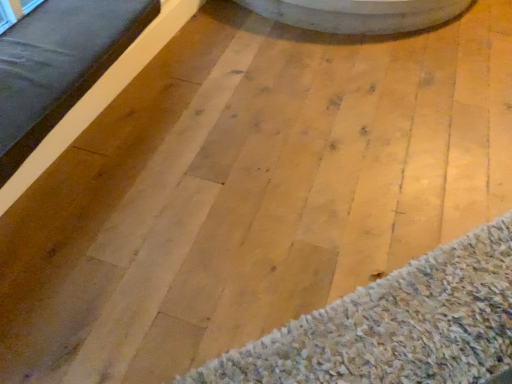
The height and width of the screenshot is (384, 512). What do you see at coordinates (58, 65) in the screenshot?
I see `matte wood bed frame at left` at bounding box center [58, 65].

Where is `matte wood bed frame at left`? The width and height of the screenshot is (512, 384). matte wood bed frame at left is located at coordinates (58, 65).

I want to click on woolen carpet at lower right, so click(396, 326).

The width and height of the screenshot is (512, 384). Describe the element at coordinates (396, 326) in the screenshot. I see `woolen carpet at lower right` at that location.

Locate an element on the screen. This screenshot has width=512, height=384. matte wood bed frame at left is located at coordinates coord(58,65).

Considering the positions of objects matte wood bed frame at left and woolen carpet at lower right in the image provided, who is more to the left, matte wood bed frame at left or woolen carpet at lower right?

Positioned to the left is matte wood bed frame at left.

In the image, is matte wood bed frame at left positioned in front of or behind woolen carpet at lower right?

matte wood bed frame at left is positioned farther from the viewer than woolen carpet at lower right.

Does point (13, 130) appear closer or farther from the camera than point (454, 304)?

Point (13, 130) is farther from the camera than point (454, 304).

From the image's perspective, between matte wood bed frame at left and woolen carpet at lower right, which one is located above?

matte wood bed frame at left, from the image's perspective.

From a real-world perspective, is matte wood bed frame at left above or below woolen carpet at lower right?

matte wood bed frame at left is above woolen carpet at lower right.

Looking at their sizes, would you say matte wood bed frame at left is wider or thinner than woolen carpet at lower right?

Considering their sizes, matte wood bed frame at left looks broader than woolen carpet at lower right.

Is matte wood bed frame at left shorter than woolen carpet at lower right?

In fact, matte wood bed frame at left may be taller than woolen carpet at lower right.

Is matte wood bed frame at left bigger or smaller than woolen carpet at lower right?

matte wood bed frame at left is bigger than woolen carpet at lower right.

Is matte wood bed frame at left outside of woolen carpet at lower right?

Absolutely, matte wood bed frame at left is external to woolen carpet at lower right.

Is matte wood bed frame at left positioned far away from woolen carpet at lower right?

That's right, there is a large distance between matte wood bed frame at left and woolen carpet at lower right.

Could you tell me if matte wood bed frame at left is turned towards woolen carpet at lower right?

No, matte wood bed frame at left is not turned towards woolen carpet at lower right.

From the picture: How different are the orientations of matte wood bed frame at left and woolen carpet at lower right in degrees?

They differ by 136 degrees in their facing directions.

How far apart are matte wood bed frame at left and woolen carpet at lower right?

They are 1.17 meters apart.

The height and width of the screenshot is (384, 512). Identify the location of furniture behind the woolen carpet at lower right. (58, 65).

Can you confirm if woolen carpet at lower right is positioned to the left of matte wood bed frame at left?

In fact, woolen carpet at lower right is to the right of matte wood bed frame at left.

Considering the positions of objects woolen carpet at lower right and matte wood bed frame at left in the image provided, who is behind, woolen carpet at lower right or matte wood bed frame at left?

matte wood bed frame at left is more distant.

Which is more distant, (382, 345) or (67, 40)?

Point (67, 40)

From the image's perspective, is woolen carpet at lower right above matte wood bed frame at left?

Actually, woolen carpet at lower right appears below matte wood bed frame at left in the image.

From a real-world perspective, is woolen carpet at lower right located beneath matte wood bed frame at left?

Yes.

Which object is wider, woolen carpet at lower right or matte wood bed frame at left?

matte wood bed frame at left is wider.

Considering the sizes of objects woolen carpet at lower right and matte wood bed frame at left in the image provided, who is taller, woolen carpet at lower right or matte wood bed frame at left?

With more height is matte wood bed frame at left.

Is woolen carpet at lower right bigger or smaller than matte wood bed frame at left?

In the image, woolen carpet at lower right appears to be smaller than matte wood bed frame at left.

Which is correct: woolen carpet at lower right is inside matte wood bed frame at left, or outside of it?

woolen carpet at lower right cannot be found inside matte wood bed frame at left.

Would you say woolen carpet at lower right is a long distance from matte wood bed frame at left?

Absolutely, woolen carpet at lower right is distant from matte wood bed frame at left.

Is woolen carpet at lower right looking in the opposite direction of matte wood bed frame at left?

That's not correct — woolen carpet at lower right is not looking away from matte wood bed frame at left.

Consider the image. Can you tell me how much woolen carpet at lower right and matte wood bed frame at left differ in facing direction?

The facing directions of woolen carpet at lower right and matte wood bed frame at left are 136 degrees apart.

Measure the distance from woolen carpet at lower right to matte wood bed frame at left.

The distance of woolen carpet at lower right from matte wood bed frame at left is 1.17 meters.

You are a GUI agent. You are given a task and a screenshot of the screen. Output one action in this format:
    pyautogui.click(x=<x>, y=<y>)
    Task: Click on the mat in front of the matte wood bed frame at left
    The height and width of the screenshot is (384, 512).
    Given the screenshot: What is the action you would take?
    pyautogui.click(x=396, y=326)

Identify the location of mat located in front of the matte wood bed frame at left. This screenshot has height=384, width=512. (396, 326).

Locate an element on the screen. furniture lying above the woolen carpet at lower right (from the image's perspective) is located at coordinates (58, 65).